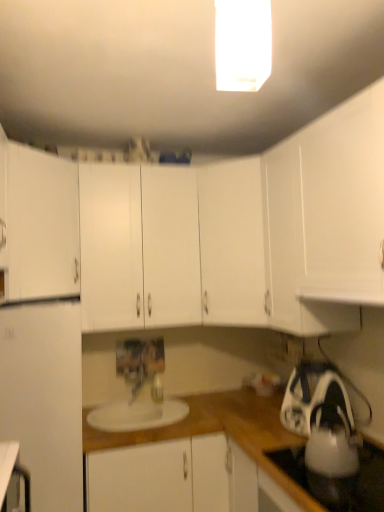
Where is `white matte cabinet at left, which appears as the first cabinetry when viewed from the top`? white matte cabinet at left, which appears as the first cabinetry when viewed from the top is located at coordinates coord(39,224).

Describe the element at coordinates (332, 446) in the screenshot. I see `white glossy tea pot at lower right` at that location.

Measure the distance between point (114, 477) and camera.

Point (114, 477) is 2.04 meters from camera.

What do you see at coordinates (367, 482) in the screenshot? I see `white glossy gas stove at lower right` at bounding box center [367, 482].

I want to click on white glossy gas stove at lower right, so click(367, 482).

Locate an element on the screen. white matte cabinet at left, placed as the fourth cabinetry when sorted from bottom to top is located at coordinates (39, 224).

Which object is positioned more to the right, white glossy rectangular light fixture at upper center or white glossy gas stove at lower right?

white glossy gas stove at lower right is more to the right.

Locate an element on the screen. Image resolution: width=384 pixels, height=512 pixels. light fixture lying in front of the white glossy gas stove at lower right is located at coordinates (242, 44).

From the image's perspective, between white glossy rectangular light fixture at upper center and white glossy gas stove at lower right, who is located below?

white glossy gas stove at lower right appears lower in the image.

From a real-world perspective, who is located lower, white matte cabinet at center, which ranks as the first cabinetry in bottom-to-top order, or white matte iron at lower right?

white matte cabinet at center, which ranks as the first cabinetry in bottom-to-top order, is physically lower.

Is white matte cabinet at center, the fourth cabinetry positioned from the top, in contact with white matte iron at lower right?

No, white matte cabinet at center, the fourth cabinetry positioned from the top, is not beside white matte iron at lower right.

From the image's perspective, is white matte cabinet at center, which ranks as the first cabinetry in bottom-to-top order, positioned above or below white matte iron at lower right?

white matte cabinet at center, which ranks as the first cabinetry in bottom-to-top order, is situated lower than white matte iron at lower right in the image.

In the scene shown: Is white matte cabinet at center, which ranks as the first cabinetry in bottom-to-top order, thinner than white matte iron at lower right?

In fact, white matte cabinet at center, which ranks as the first cabinetry in bottom-to-top order, might be wider than white matte iron at lower right.

Based on their sizes in the image, would you say white glossy rectangular light fixture at upper center is bigger or smaller than white matte cabinet at center, the second cabinetry in the top-to-bottom sequence?

In the image, white glossy rectangular light fixture at upper center appears to be smaller than white matte cabinet at center, the second cabinetry in the top-to-bottom sequence.

Looking at this image, between white glossy rectangular light fixture at upper center and white matte cabinet at center, the 3th cabinetry in the bottom-to-top sequence, which one has larger width?

white matte cabinet at center, the 3th cabinetry in the bottom-to-top sequence, is wider.

Does white glossy rectangular light fixture at upper center appear on the right side of white matte cabinet at center, the 3th cabinetry in the bottom-to-top sequence?

No.

How different are the orientations of white glossy rectangular light fixture at upper center and white matte cabinet at center, the second cabinetry in the top-to-bottom sequence, in degrees?

They differ by 36.2 degrees in their facing directions.

Considering the sizes of objects white matte cabinet at left, placed as the fourth cabinetry when sorted from bottom to top, and white matte cabinet at center, the second cabinetry in the top-to-bottom sequence, in the image provided, who is shorter, white matte cabinet at left, placed as the fourth cabinetry when sorted from bottom to top, or white matte cabinet at center, the second cabinetry in the top-to-bottom sequence,?

With less height is white matte cabinet at left, placed as the fourth cabinetry when sorted from bottom to top.

Between white matte cabinet at left, which appears as the first cabinetry when viewed from the top, and white matte cabinet at center, the second cabinetry in the top-to-bottom sequence, which one appears on the right side from the viewer's perspective?

From the viewer's perspective, white matte cabinet at center, the second cabinetry in the top-to-bottom sequence, appears more on the right side.

Is white matte cabinet at left, placed as the fourth cabinetry when sorted from bottom to top, in contact with white matte cabinet at center, the second cabinetry in the top-to-bottom sequence?

No, white matte cabinet at left, placed as the fourth cabinetry when sorted from bottom to top, is not touching white matte cabinet at center, the second cabinetry in the top-to-bottom sequence.

In the scene shown: Who is bigger, white matte cabinet at left, which appears as the first cabinetry when viewed from the top, or white matte cabinet at center, the 3th cabinetry in the bottom-to-top sequence?

white matte cabinet at center, the 3th cabinetry in the bottom-to-top sequence, is bigger.

Based on the photo, is white matte cabinet at center, the 3th cabinetry in the bottom-to-top sequence, wider than white glossy tea pot at lower right?

Indeed, white matte cabinet at center, the 3th cabinetry in the bottom-to-top sequence, has a greater width compared to white glossy tea pot at lower right.

From the picture: Can you confirm if white matte cabinet at center, the 3th cabinetry in the bottom-to-top sequence, is shorter than white glossy tea pot at lower right?

Incorrect, the height of white matte cabinet at center, the 3th cabinetry in the bottom-to-top sequence, does not fall short of that of white glossy tea pot at lower right.

Does white matte cabinet at center, the second cabinetry in the top-to-bottom sequence, contain white glossy tea pot at lower right?

Actually, white glossy tea pot at lower right is outside white matte cabinet at center, the second cabinetry in the top-to-bottom sequence.

Is white matte cabinet at center, the second cabinetry in the top-to-bottom sequence, aimed at white glossy tea pot at lower right?

No, white matte cabinet at center, the second cabinetry in the top-to-bottom sequence, is not facing towards white glossy tea pot at lower right.

Looking at this image, who is taller, white glossy tea pot at lower right or white matte cabinet at left, which appears as the first cabinetry when viewed from the top?

white matte cabinet at left, which appears as the first cabinetry when viewed from the top.

From the image's perspective, which is below, white glossy tea pot at lower right or white matte cabinet at left, placed as the fourth cabinetry when sorted from bottom to top?

white glossy tea pot at lower right is shown below in the image.

Between white glossy tea pot at lower right and white matte cabinet at left, which appears as the first cabinetry when viewed from the top, which one is positioned in front?

white glossy tea pot at lower right is closer to the camera.

Which of these two, white matte refrigerator at left or white glossy gas stove at lower right, is smaller?

white glossy gas stove at lower right.

Where is `gas stove to the right of white matte refrigerator at left`? gas stove to the right of white matte refrigerator at left is located at coordinates (367, 482).

Is white matte refrigerator at left not within white glossy gas stove at lower right?

That's correct, white matte refrigerator at left is outside of white glossy gas stove at lower right.

From a real-world perspective, relative to white glossy gas stove at lower right, is white matte refrigerator at left vertically above or below?

white matte refrigerator at left is above white glossy gas stove at lower right.

Identify the location of light fixture in front of the white glossy gas stove at lower right. The width and height of the screenshot is (384, 512). (242, 44).

Image resolution: width=384 pixels, height=512 pixels. What are the coordinates of `cabinetry directly beneath the white matte iron at lower right (from a real-world perspective)` in the screenshot? It's located at (161, 477).

Which object lies nearer to the anchor point white matte cabinet at left, which appears as the first cabinetry when viewed from the top, white matte cabinet at center, the 3th cabinetry in the bottom-to-top sequence, or white glossy gas stove at lower right?

The object closer to white matte cabinet at left, which appears as the first cabinetry when viewed from the top, is white matte cabinet at center, the 3th cabinetry in the bottom-to-top sequence.

Looking at the image, which one is located closer to white glossy tea pot at lower right, white matte cabinet at left, placed as the fourth cabinetry when sorted from bottom to top, or white matte iron at lower right?

white matte iron at lower right is positioned closer to the anchor white glossy tea pot at lower right.

Estimate the real-world distances between objects in this image. Which object is closer to white matte cabinet at center, the second cabinetry in the top-to-bottom sequence, white matte iron at lower right or white glossy rectangular light fixture at upper center?

white matte iron at lower right is closer to white matte cabinet at center, the second cabinetry in the top-to-bottom sequence.

Which object lies nearer to the anchor point white glossy gas stove at lower right, white matte cabinet at left, which appears as the first cabinetry when viewed from the top, or white matte refrigerator at left?

white matte refrigerator at left is closer to white glossy gas stove at lower right.

Considering their positions, is white glossy rectangular light fixture at upper center positioned further to white matte refrigerator at left than white matte cabinet at left, which appears as the first cabinetry when viewed from the top?

white glossy rectangular light fixture at upper center is further to white matte refrigerator at left.

From the image, which object appears to be nearer to white matte refrigerator at left, white matte iron at lower right or white glossy gas stove at lower right?

Based on the image, white glossy gas stove at lower right appears to be nearer to white matte refrigerator at left.

Which object lies nearer to the anchor point white matte cabinet at center, which ranks as the first cabinetry in bottom-to-top order, white matte iron at lower right or white glossy tea pot at lower right?

Based on the image, white matte iron at lower right appears to be nearer to white matte cabinet at center, which ranks as the first cabinetry in bottom-to-top order.

Estimate the real-world distances between objects in this image. Which object is further from white matte cabinet at center, the second cabinetry in the top-to-bottom sequence, white glossy gas stove at lower right or white matte refrigerator at left?

white glossy gas stove at lower right is further to white matte cabinet at center, the second cabinetry in the top-to-bottom sequence.

Locate an element on the screen. light fixture between white matte cabinet at left, which appears as the first cabinetry when viewed from the top, and white glossy gas stove at lower right is located at coordinates (242, 44).

Where is `light fixture located between white matte cabinet at left, which appears as the first cabinetry when viewed from the top, and white glossy tea pot at lower right in the left-right direction`? The height and width of the screenshot is (512, 384). light fixture located between white matte cabinet at left, which appears as the first cabinetry when viewed from the top, and white glossy tea pot at lower right in the left-right direction is located at coordinates (242, 44).

Where is `tea pot situated between white matte cabinet at center, the third cabinetry viewed from the top, and white glossy gas stove at lower right from left to right`? The image size is (384, 512). tea pot situated between white matte cabinet at center, the third cabinetry viewed from the top, and white glossy gas stove at lower right from left to right is located at coordinates (332, 446).

The height and width of the screenshot is (512, 384). In order to click on appliance between white matte cabinet at center, which ranks as the first cabinetry in bottom-to-top order, and white glossy gas stove at lower right from left to right in this screenshot , I will do `click(322, 420)`.